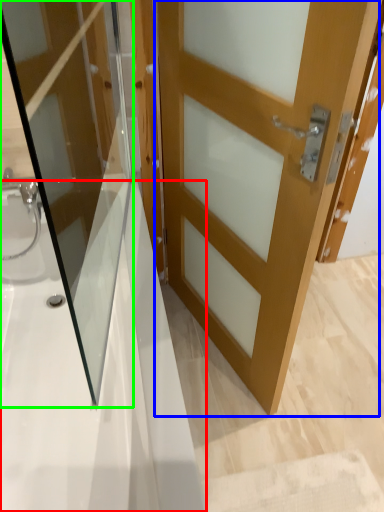
Question: Which is farther away from bath (highlighted by a red box)? door (highlighted by a blue box) or door (highlighted by a green box)?

Choices:
 (A) door
 (B) door

Answer: (A)